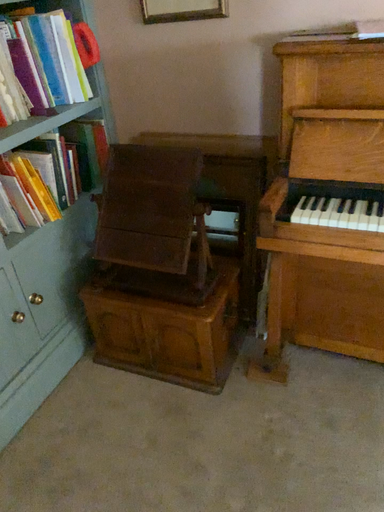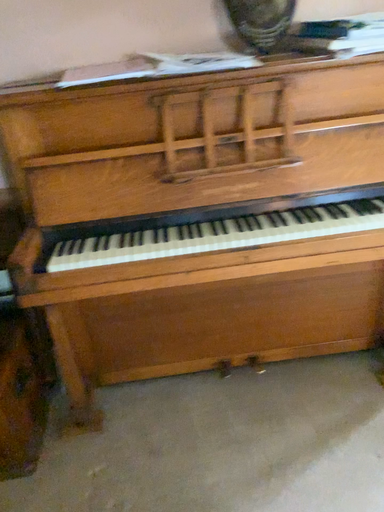
Question: How did the camera likely rotate when shooting the video?

Choices:
 (A) rotated left
 (B) rotated right

Answer: (B)